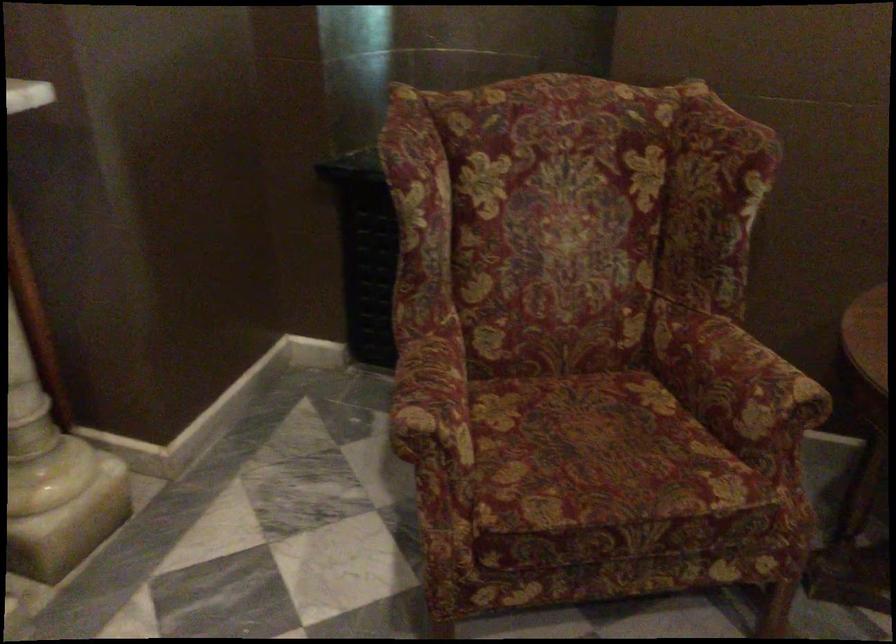
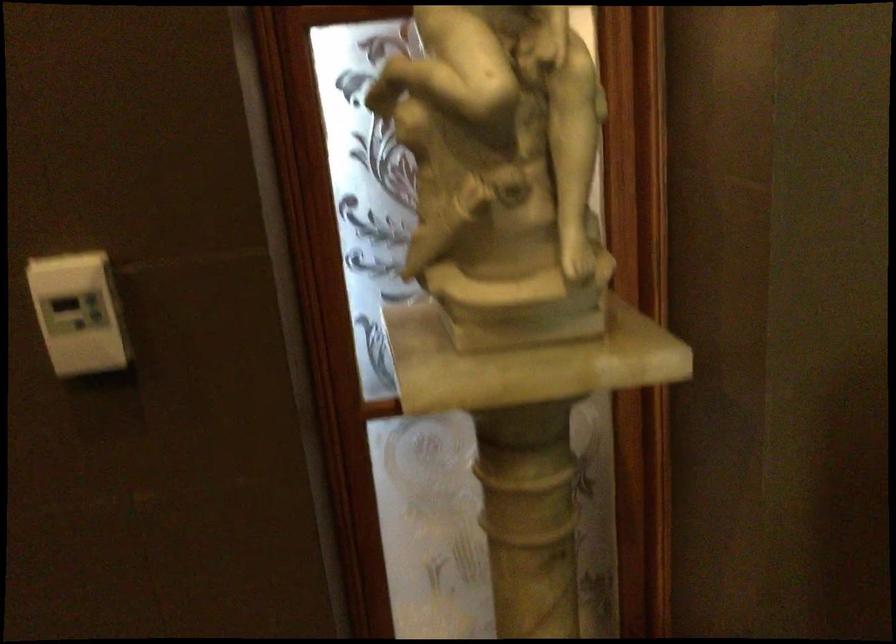
Question: The first image is from the beginning of the video and the second image is from the end. How did the camera likely rotate when shooting the video?

Choices:
 (A) Left
 (B) Right
 (C) Up
 (D) Down

Answer: (A)